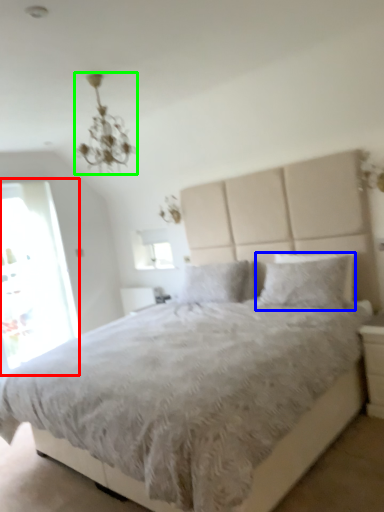
Question: Considering the real-world distances, which object is closest to glass door (highlighted by a red box)? pillow (highlighted by a blue box) or light fixture (highlighted by a green box).

Choices:
 (A) pillow
 (B) light fixture

Answer: (B)